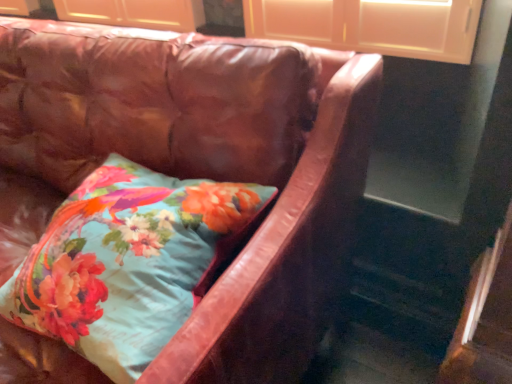
Question: Relative to floral fabric pillow at center, is leather couch at center in front or behind?

Choices:
 (A) front
 (B) behind

Answer: (A)

Question: In the image, is leather couch at center on the left side or the right side of floral fabric pillow at center?

Choices:
 (A) right
 (B) left

Answer: (B)

Question: Considering the positions of point (195, 125) and point (69, 200), is point (195, 125) closer or farther from the camera than point (69, 200)?

Choices:
 (A) closer
 (B) farther

Answer: (A)

Question: From the image's perspective, is floral fabric pillow at center located above or below leather couch at center?

Choices:
 (A) above
 (B) below

Answer: (B)

Question: From a real-world perspective, relative to leather couch at center, is floral fabric pillow at center vertically above or below?

Choices:
 (A) below
 (B) above

Answer: (B)

Question: Looking at their shapes, would you say floral fabric pillow at center is wider or thinner than leather couch at center?

Choices:
 (A) thin
 (B) wide

Answer: (A)

Question: Considering the positions of floral fabric pillow at center and leather couch at center in the image, is floral fabric pillow at center bigger or smaller than leather couch at center?

Choices:
 (A) small
 (B) big

Answer: (A)